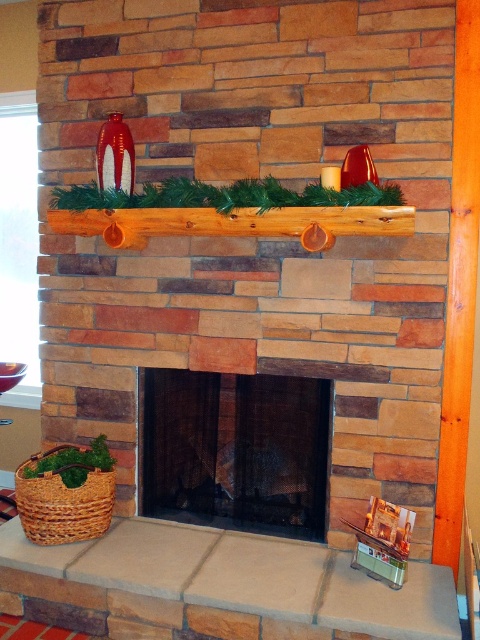
Question: Which object appears farthest from the camera in this image?

Choices:
 (A) brown wooden mantel at center
 (B) smooth wood mantel at center

Answer: (A)

Question: Does smooth wood mantel at center lie in front of black mesh fireplace at center?

Choices:
 (A) no
 (B) yes

Answer: (B)

Question: From the image, what is the correct spatial relationship of smooth wood mantel at center in relation to black mesh fireplace at center?

Choices:
 (A) left
 (B) right

Answer: (A)

Question: Estimate the real-world distances between objects in this image. Which object is closer to the brown wooden mantel at center?

Choices:
 (A) smooth wood mantel at center
 (B) black mesh fireplace at center

Answer: (B)

Question: Which point is farther from the camera taking this photo?

Choices:
 (A) pos(254,461)
 (B) pos(328,618)

Answer: (A)

Question: Can you confirm if smooth wood mantel at center is positioned below brown wooden mantel at center?

Choices:
 (A) yes
 (B) no

Answer: (A)